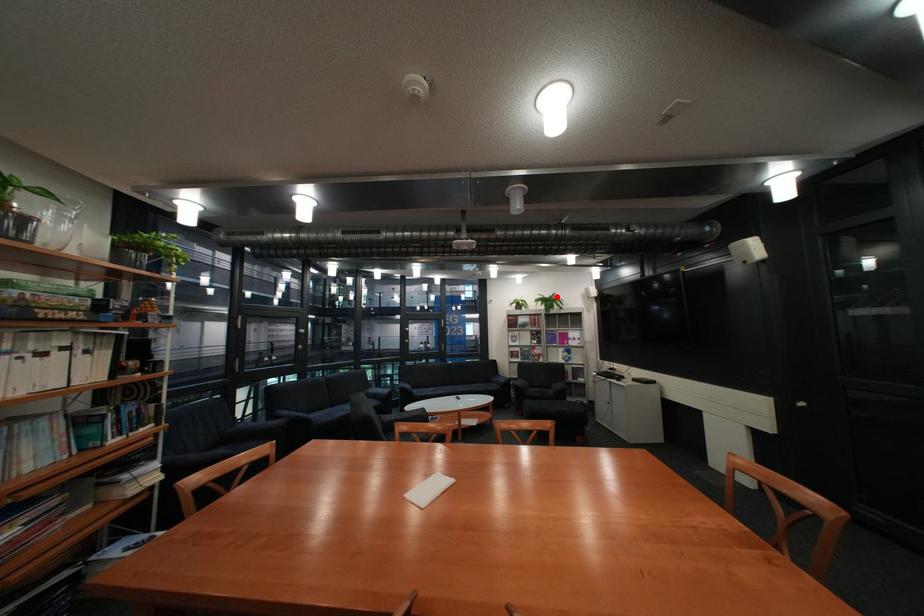
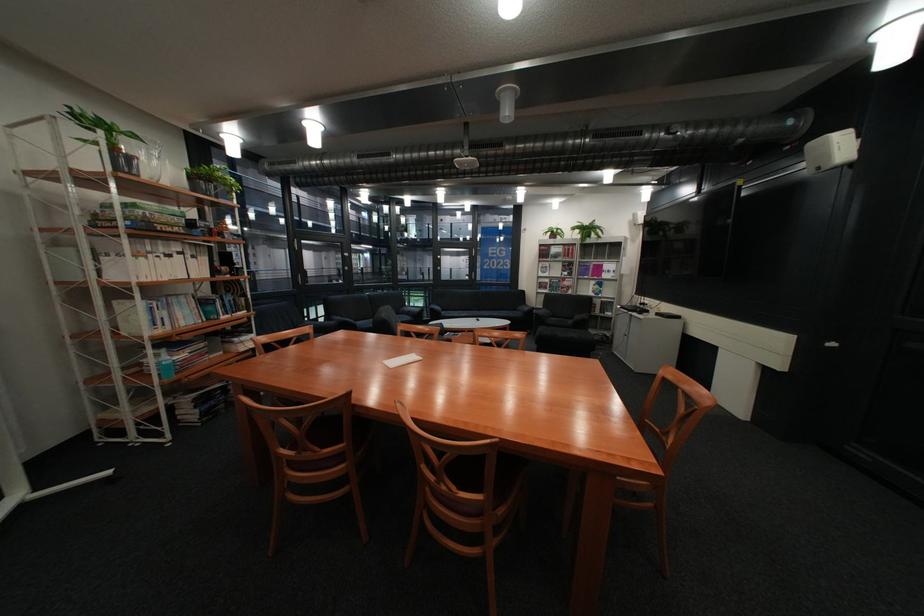
In the second image, find the point that corresponds to the highlighted location in the first image.

(594, 225)